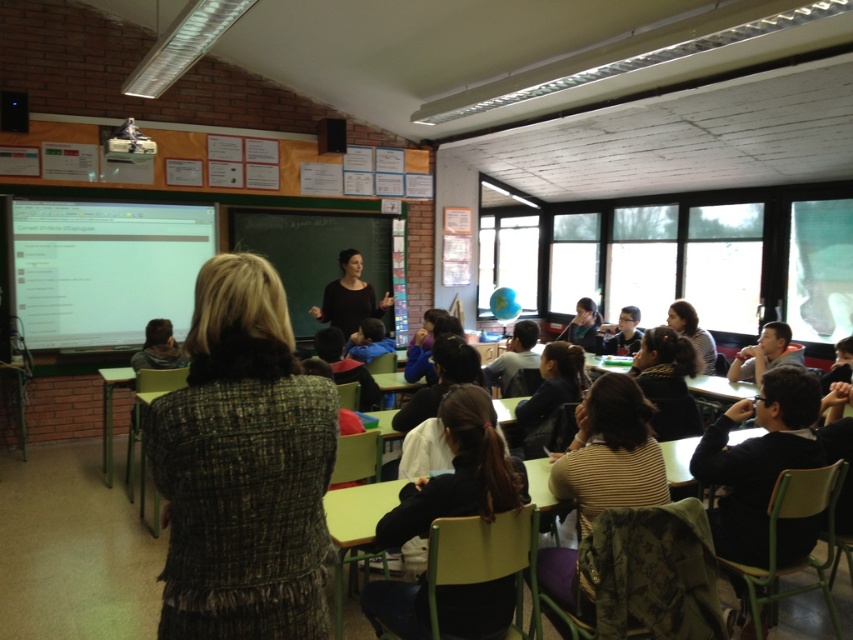
Question: Which object is farther from the camera taking this photo?

Choices:
 (A) green chalkboard at center
 (B) black matte/black dress at center

Answer: (A)

Question: Observing the image, what is the correct spatial positioning of green chalkboard at center in reference to black matte/black dress at center?

Choices:
 (A) above
 (B) below

Answer: (A)

Question: Can you confirm if green chalkboard at center is positioned below black matte/black dress at center?

Choices:
 (A) no
 (B) yes

Answer: (A)

Question: Which point appears closest to the camera in this image?

Choices:
 (A) (364, 218)
 (B) (323, 292)

Answer: (B)

Question: Can you confirm if green chalkboard at center is positioned to the right of black matte/black dress at center?

Choices:
 (A) no
 (B) yes

Answer: (A)